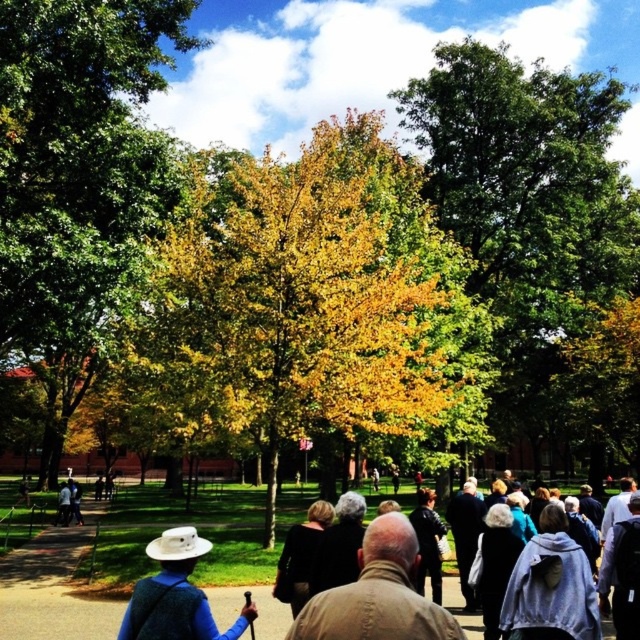
Question: Is green leafy tree at center positioned at the back of dark blue sweater at center?

Choices:
 (A) no
 (B) yes

Answer: (B)

Question: Is green leafy tree at center below dark blue sweater at center?

Choices:
 (A) yes
 (B) no

Answer: (B)

Question: Which point is closer to the camera?

Choices:
 (A) yellow leafy tree at center
 (B) green leafy tree at center
 (C) black matte jacket at center

Answer: (C)

Question: Which point is closer to the camera?

Choices:
 (A) light blue shirt at lower left
 (B) brown paved path at center

Answer: (B)

Question: Does blue fabric backpack at center have a greater width compared to black matte jacket at center?

Choices:
 (A) yes
 (B) no

Answer: (B)

Question: Which object is farther from the camera taking this photo?

Choices:
 (A) yellow-green leaves at center
 (B) dark brown leather jacket at center
 (C) black matte jacket at center

Answer: (A)